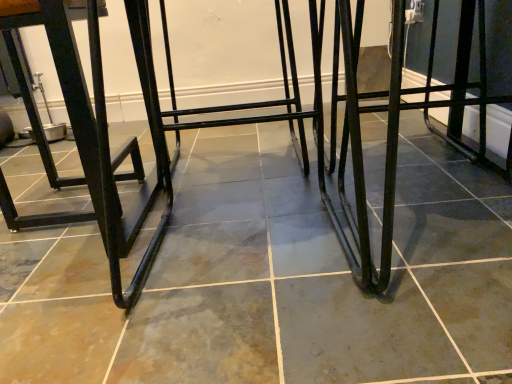
Locate an element on the screen. vacant space behind black metal step stool at center is located at coordinates (397, 170).